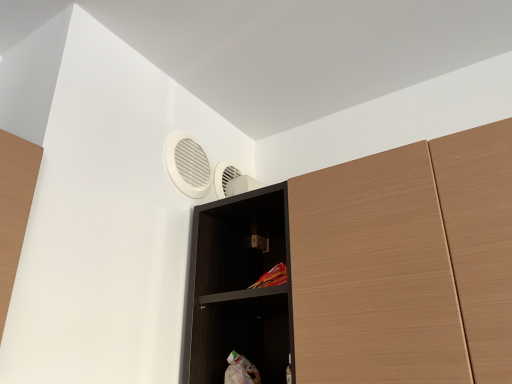
Question: Does wooden cupboard at upper right have a larger size compared to black wood shelf at upper center?

Choices:
 (A) yes
 (B) no

Answer: (A)

Question: Is wooden cupboard at upper right behind black wood shelf at upper center?

Choices:
 (A) no
 (B) yes

Answer: (A)

Question: From a real-world perspective, is wooden cupboard at upper right located beneath black wood shelf at upper center?

Choices:
 (A) no
 (B) yes

Answer: (B)

Question: Does wooden cupboard at upper right have a lesser width compared to black wood shelf at upper center?

Choices:
 (A) no
 (B) yes

Answer: (A)

Question: Is wooden cupboard at upper right aimed at black wood shelf at upper center?

Choices:
 (A) yes
 (B) no

Answer: (B)

Question: Are wooden cupboard at upper right and black wood shelf at upper center making contact?

Choices:
 (A) no
 (B) yes

Answer: (B)

Question: From a real-world perspective, is black wood shelf at upper center over wooden cupboard at upper right?

Choices:
 (A) no
 (B) yes

Answer: (B)

Question: Is black wood shelf at upper center smaller than wooden cupboard at upper right?

Choices:
 (A) yes
 (B) no

Answer: (A)

Question: Can you confirm if black wood shelf at upper center is positioned to the right of wooden cupboard at upper right?

Choices:
 (A) yes
 (B) no

Answer: (B)

Question: Would you say black wood shelf at upper center contains wooden cupboard at upper right?

Choices:
 (A) no
 (B) yes

Answer: (A)

Question: Is black wood shelf at upper center far away from wooden cupboard at upper right?

Choices:
 (A) yes
 (B) no

Answer: (B)

Question: Does black wood shelf at upper center have a lesser width compared to wooden cupboard at upper right?

Choices:
 (A) yes
 (B) no

Answer: (A)

Question: Is white plastic air conditioning at upper center further to camera compared to wooden cupboard at upper right?

Choices:
 (A) yes
 (B) no

Answer: (A)